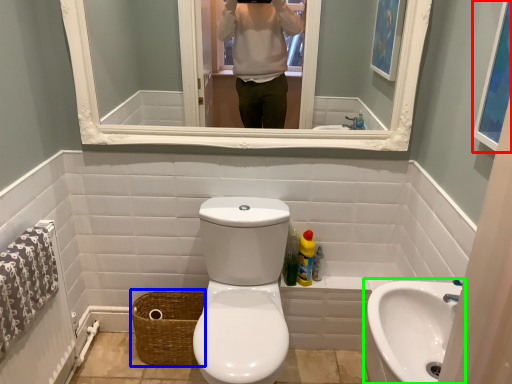
Question: Which is farther away from picture frame (highlighted by a red box)? basket (highlighted by a blue box) or sink (highlighted by a green box)?

Choices:
 (A) basket
 (B) sink

Answer: (A)